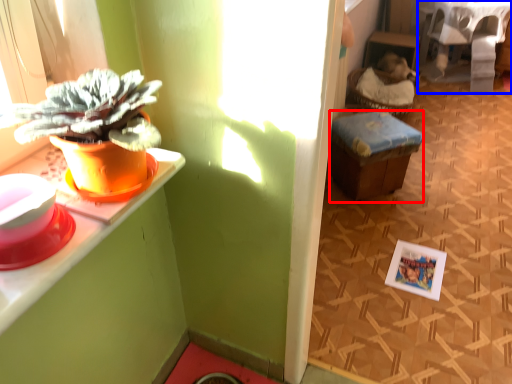
Question: Among these objects, which one is nearest to the camera, stool (highlighted by a red box) or table (highlighted by a blue box)?

Choices:
 (A) stool
 (B) table

Answer: (A)